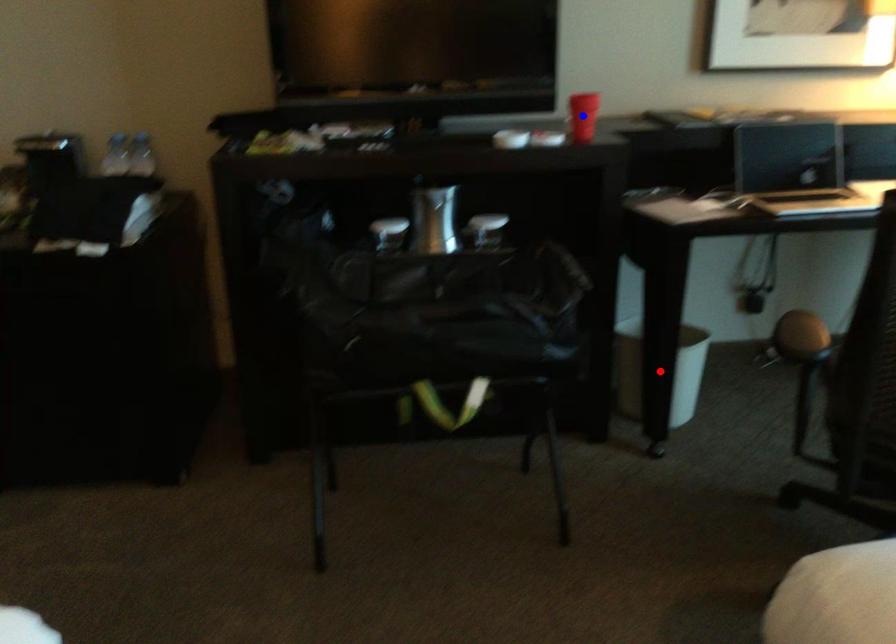
Question: In the image, two points are highlighted. Which point is nearer to the camera? Reply with the corresponding letter.

Choices:
 (A) blue point
 (B) red point

Answer: (A)